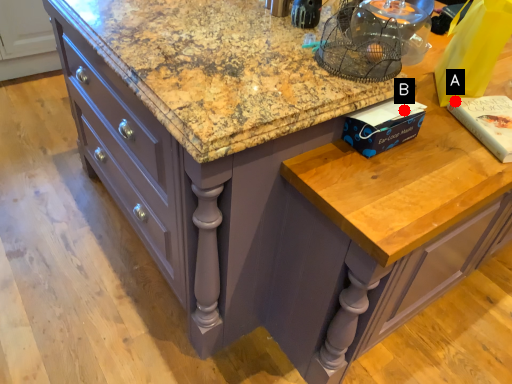
Question: Two points are circled on the image, labeled by A and B beside each circle. Which point is further to the camera?

Choices:
 (A) A is further
 (B) B is further

Answer: (A)